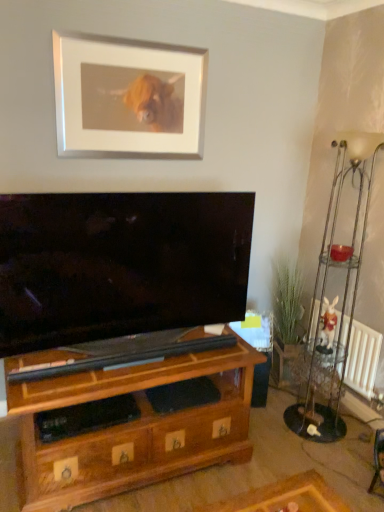
The image size is (384, 512). Identify the location of free space above white matte picture frame at upper center (from a real-world perspective). (130, 37).